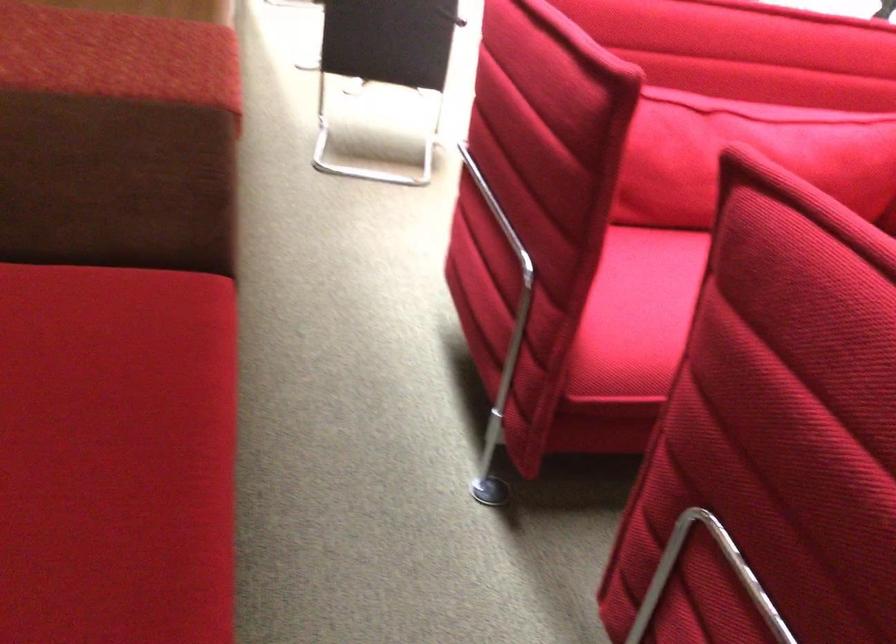
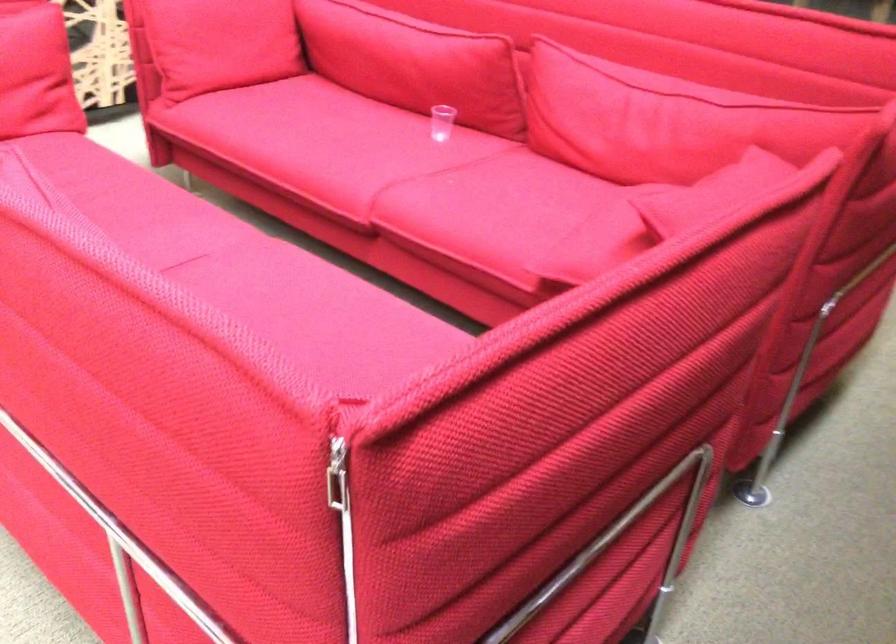
Question: I am providing you with two images of the same scene from different viewpoints. Which of the following objects are not visible in image2?

Choices:
 (A) red sofa sitting surface
 (B) silver zipper pull
 (C) blue handle screwdriver
 (D) red sofa cushion

Answer: (A)